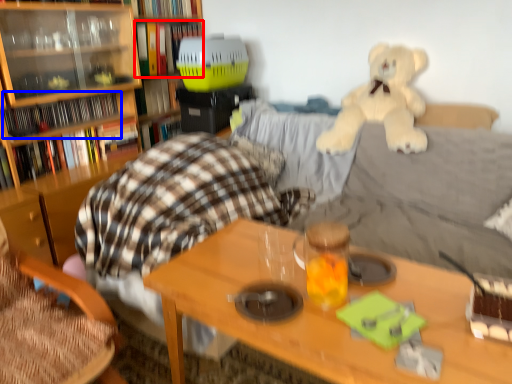
Question: Which point is closer to the camera, book (highlighted by a red box) or book (highlighted by a blue box)?

Choices:
 (A) book
 (B) book

Answer: (B)